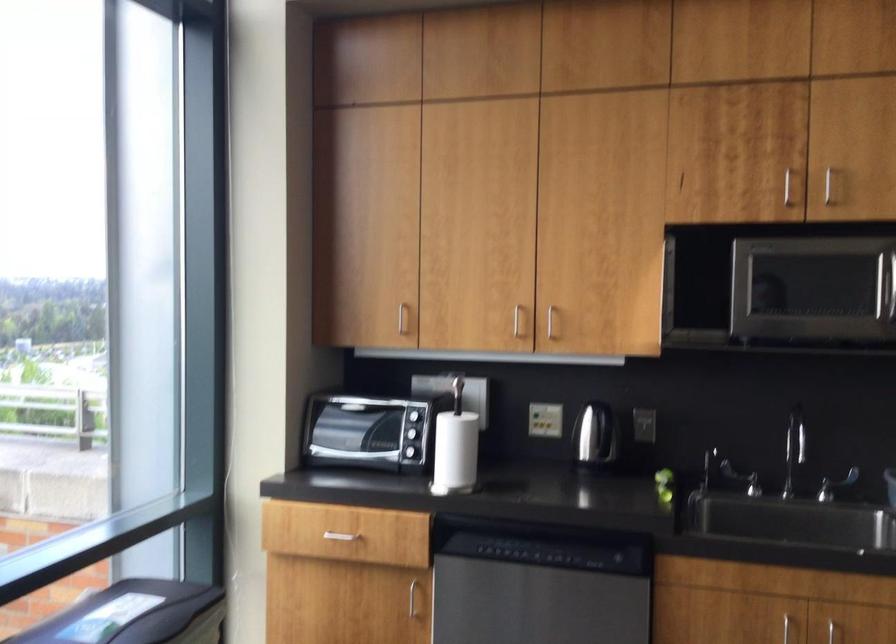
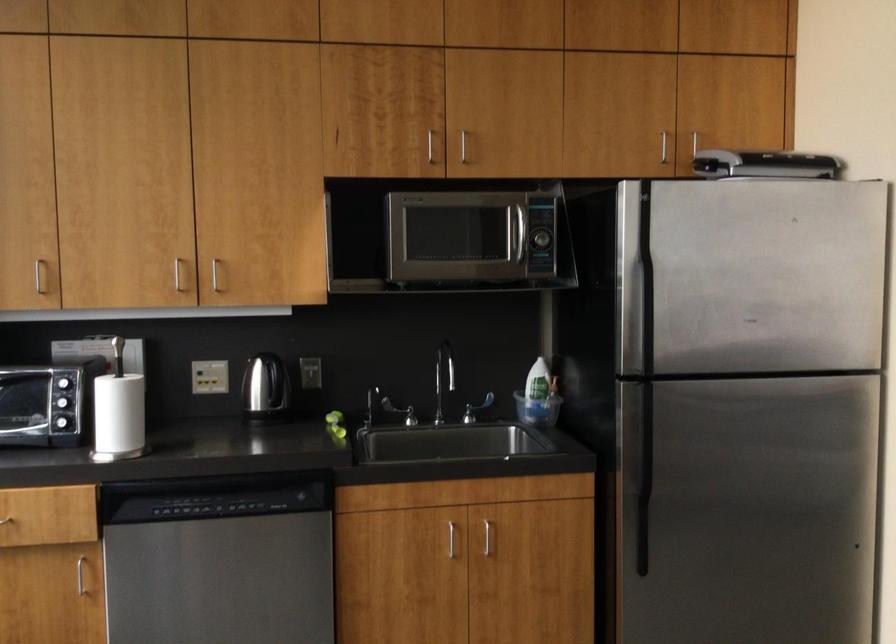
Find the pixel in the second image that matches point 599,440 in the first image.

(266, 391)